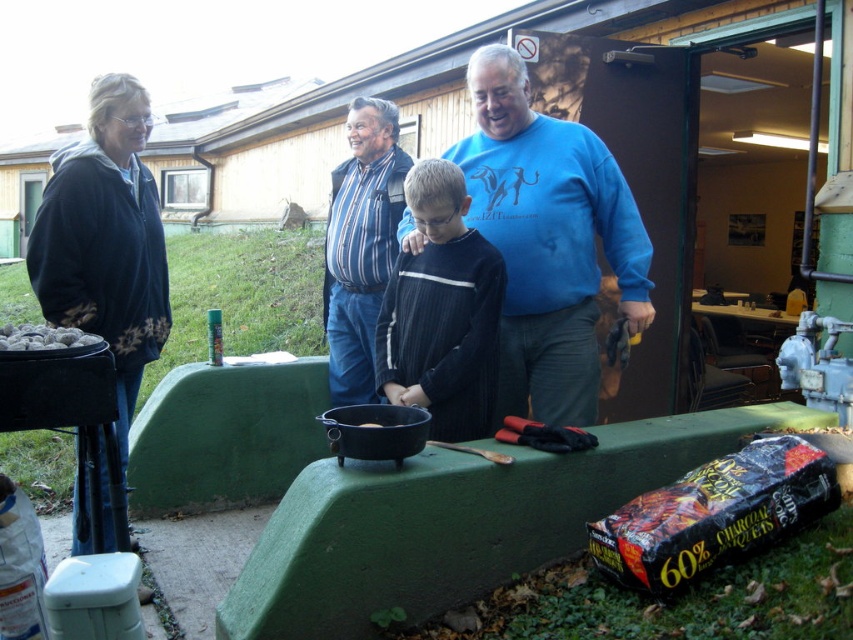
Can you confirm if blue cotton sweater at center is positioned above striped fabric shirt at center?

No, blue cotton sweater at center is not above striped fabric shirt at center.

Between blue cotton sweater at center and striped fabric shirt at center, which one has less height?

blue cotton sweater at center

The image size is (853, 640). What do you see at coordinates (548, 241) in the screenshot? I see `blue cotton sweater at center` at bounding box center [548, 241].

I want to click on blue cotton sweater at center, so click(548, 241).

Based on the photo, can you confirm if blue cotton sweater at center is wider than dark blue ribbed sweater at center?

Yes, blue cotton sweater at center is wider than dark blue ribbed sweater at center.

Does blue cotton sweater at center have a lesser height compared to dark blue ribbed sweater at center?

No.

Does point (544, 342) lie in front of point (451, 337)?

No.

This screenshot has width=853, height=640. What are the coordinates of `blue cotton sweater at center` in the screenshot? It's located at (548, 241).

Does striped fabric shirt at center have a lesser width compared to black matte pot at center?

No, striped fabric shirt at center is not thinner than black matte pot at center.

Who is lower down, striped fabric shirt at center or black matte pot at center?

Positioned lower is black matte pot at center.

Is point (337, 227) positioned after point (375, 422)?

Yes, it is behind point (375, 422).

The height and width of the screenshot is (640, 853). I want to click on striped fabric shirt at center, so click(x=360, y=244).